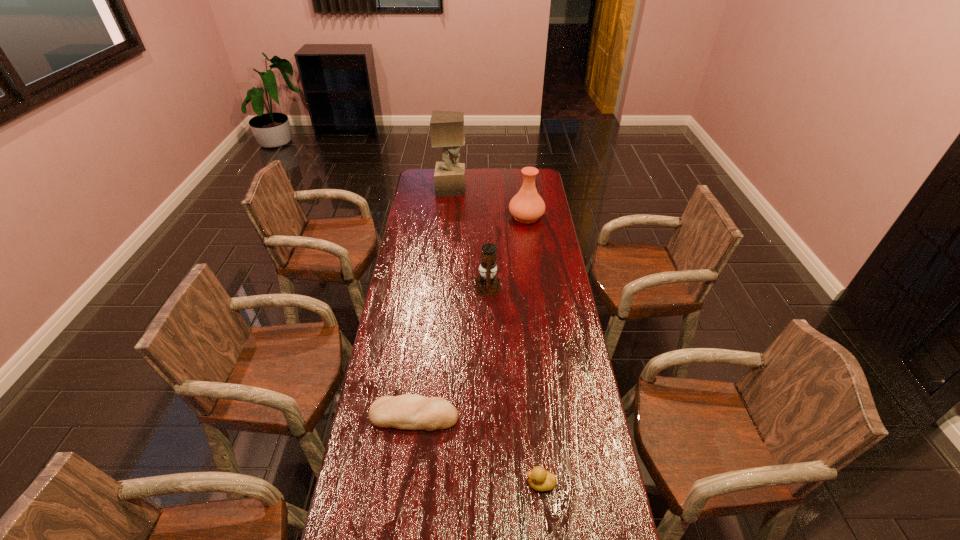
Where is `bread at the left edge`? This screenshot has width=960, height=540. bread at the left edge is located at coordinates (408, 411).

Identify the location of vase situated at the right edge. (526, 206).

Locate an element on the screen. This screenshot has width=960, height=540. duckling situated at the right edge is located at coordinates (539, 479).

Where is `object that is at the far left corner`? The height and width of the screenshot is (540, 960). object that is at the far left corner is located at coordinates (447, 127).

The height and width of the screenshot is (540, 960). I want to click on free space at the far edge, so click(472, 184).

In the image, there is a desktop. At what (x,y) coordinates should I click in order to perform the action: click on vacant area at the left edge. Please return your answer as a coordinate pair (x, y). Looking at the image, I should click on (423, 195).

What are the coordinates of `free space at the right edge` in the screenshot? It's located at (572, 330).

Locate an element on the screen. Image resolution: width=960 pixels, height=540 pixels. free space between the shortest object and the second shortest object is located at coordinates (477, 450).

Locate an element on the screen. This screenshot has width=960, height=540. vacant area between the fourth nearest object and the third object from left to right is located at coordinates (507, 252).

In order to click on vacant space that is in between the shortest object and the fourth nearest object in this screenshot , I will do `click(470, 316)`.